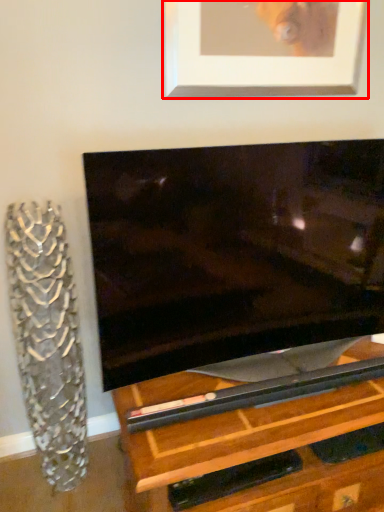
Question: From the image's perspective, what is the correct spatial positioning of picture frame (annotated by the red box) in reference to glass vase?

Choices:
 (A) above
 (B) below

Answer: (A)